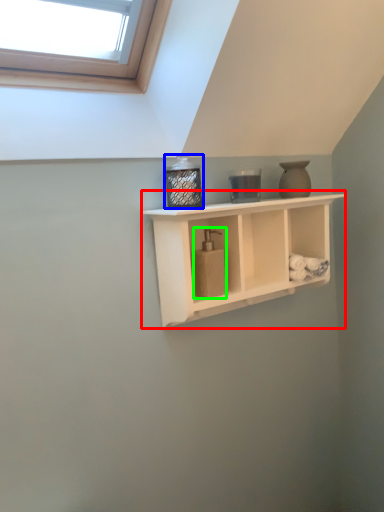
Question: Which object is the closest to the shelf (highlighted by a red box)? Choose among these: bottle (highlighted by a blue box) or soap dispenser (highlighted by a green box).

Choices:
 (A) bottle
 (B) soap dispenser

Answer: (B)